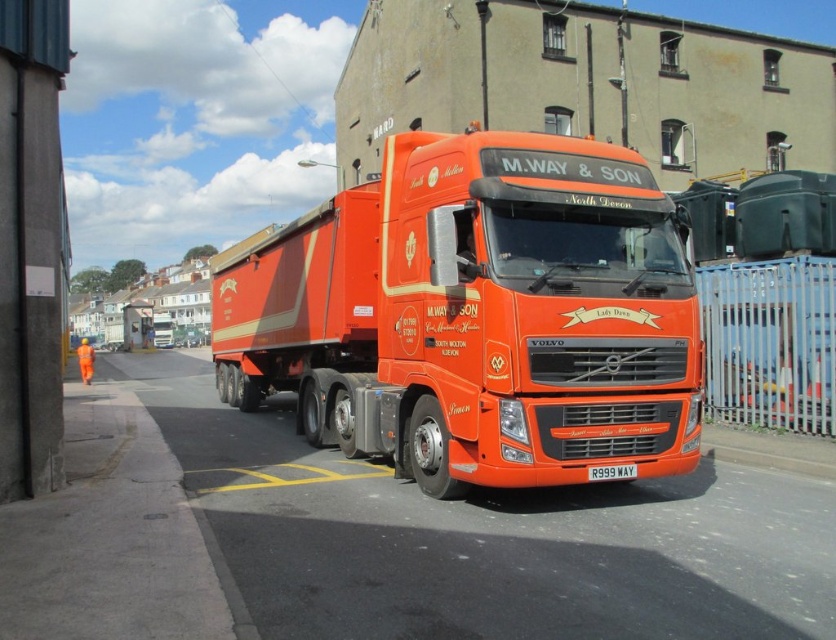
You are a delivery driver who needs to check the license plate of the matte orange truck at center. Since you can only see objects closer to you, can you see the white plastic license plate at center from your current position?

The matte orange truck at center is closer to the viewer than the white plastic license plate at center, so the license plate is behind the truck and not visible from your current position.

You are a delivery driver who needs to park the matte orange truck at center in a specific spot. The parking spot is marked at coordinates point A. If the truck is currently at point B, which is at coordinates point B, which direction should you move the truck to align it with the parking spot?

The matte orange truck at center is located at point B, so you should move it towards point A to align with the parking spot.